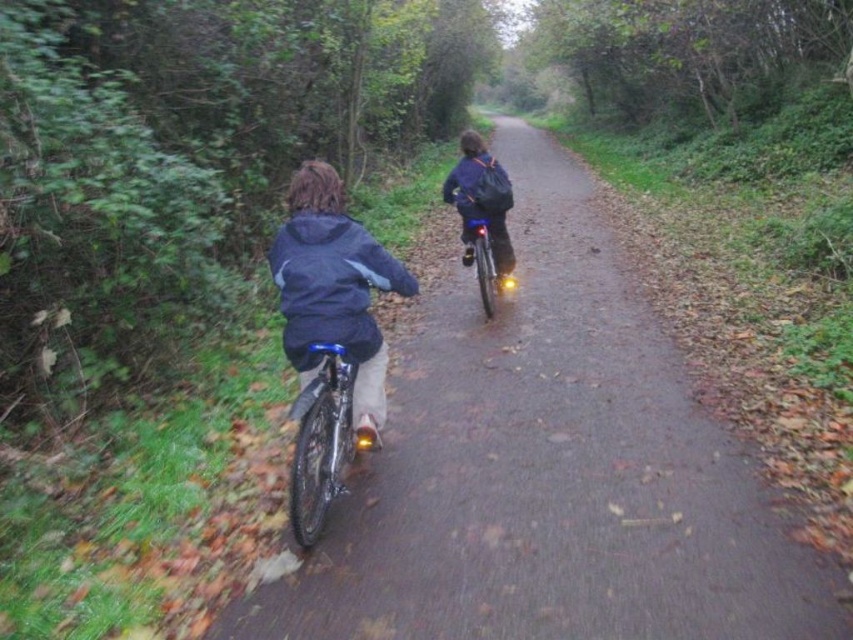
Question: Can you confirm if matte blue bicycle at center is positioned to the right of dark blue matte jacket at center?

Choices:
 (A) no
 (B) yes

Answer: (B)

Question: Estimate the real-world distances between objects in this image. Which object is closer to the dark blue matte jacket at center?

Choices:
 (A) dark blue jacket at center
 (B) matte blue bicycle at center
 (C) shiny metallic bicycle at center

Answer: (C)

Question: Which of these objects is positioned closest to the shiny metallic bicycle at center?

Choices:
 (A) shiny black bicycle at center
 (B) dark blue matte jacket at center
 (C) matte blue bicycle at center

Answer: (B)

Question: Can you confirm if dark blue matte jacket at center is bigger than dark blue jacket at center?

Choices:
 (A) no
 (B) yes

Answer: (B)

Question: Which object is positioned closest to the matte blue bicycle at center?

Choices:
 (A) shiny black bicycle at center
 (B) shiny metallic bicycle at center

Answer: (A)

Question: Observing the image, what is the correct spatial positioning of dark blue matte jacket at center in reference to shiny metallic bicycle at center?

Choices:
 (A) below
 (B) above

Answer: (B)